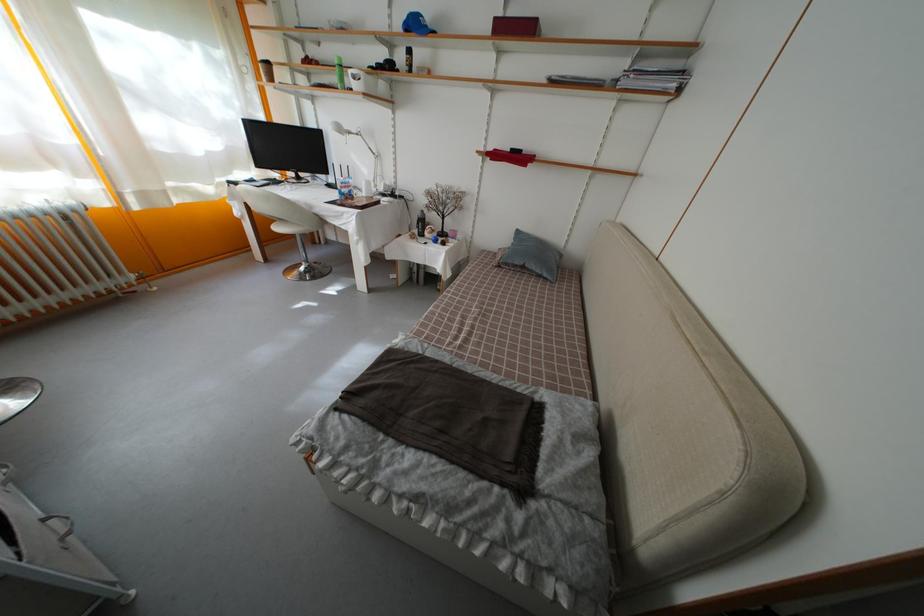
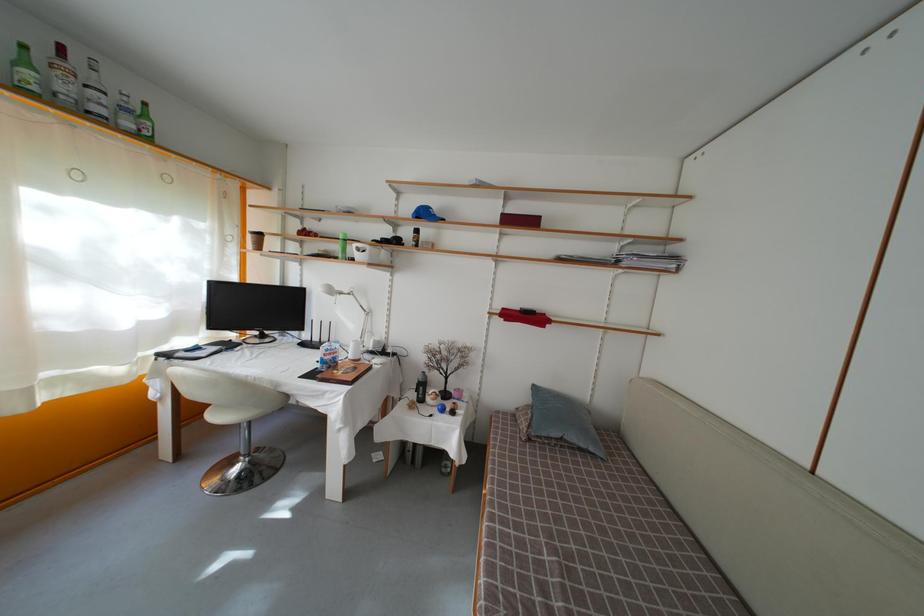
The point at (265, 63) is marked in the first image. Where is the corresponding point in the second image?

(257, 235)